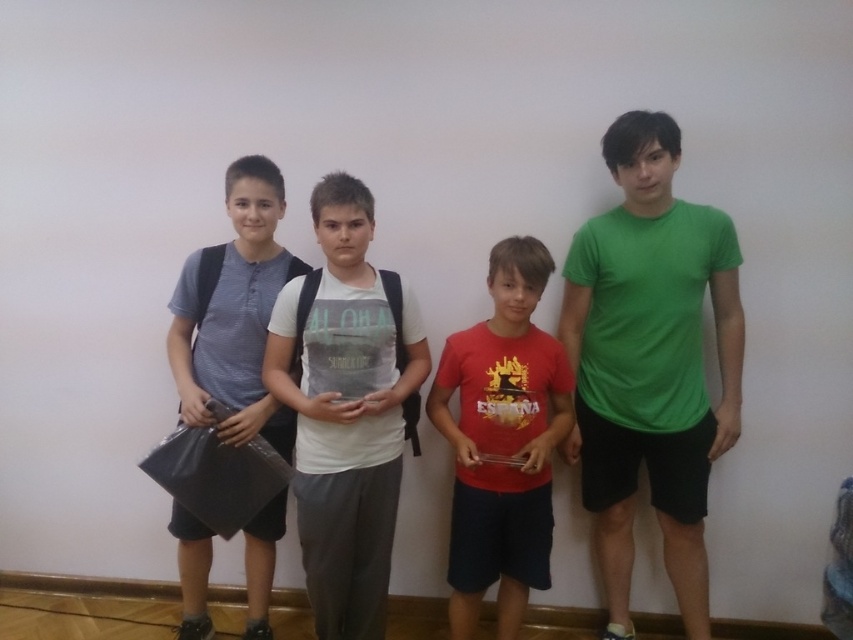
Does green matte t-shirt at right have a lesser height compared to red matte shirt at center?

No, green matte t-shirt at right is not shorter than red matte shirt at center.

Can you confirm if green matte t-shirt at right is taller than red matte shirt at center?

Yes, green matte t-shirt at right is taller than red matte shirt at center.

Which is in front, point (654, 124) or point (521, 552)?

Positioned in front is point (654, 124).

This screenshot has height=640, width=853. I want to click on green matte t-shirt at right, so click(650, 362).

From the picture: How distant is green matte t-shirt at right from matte black bag at left?

green matte t-shirt at right and matte black bag at left are 3.32 feet apart.

Is point (693, 465) positioned in front of point (190, 272)?

No, it is behind (190, 272).

The height and width of the screenshot is (640, 853). What are the coordinates of `green matte t-shirt at right` in the screenshot? It's located at (650, 362).

Between white cotton t-shirt at center and red matte shirt at center, which one is positioned higher?

Positioned higher is white cotton t-shirt at center.

Is point (380, 394) behind point (541, 364)?

That is False.

Who is more forward, (424, 358) or (500, 541)?

Point (424, 358) is more forward.

At what (x,y) coordinates should I click in order to perform the action: click on white cotton t-shirt at center. Please return your answer as a coordinate pair (x, y). This screenshot has width=853, height=640. Looking at the image, I should click on (346, 412).